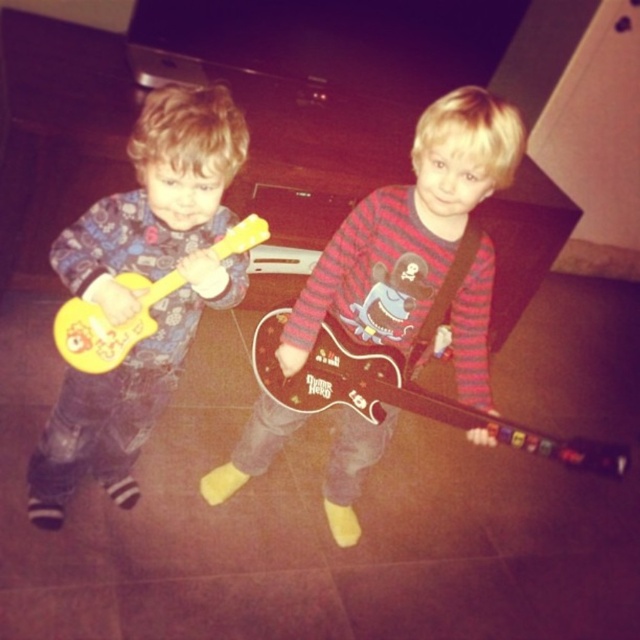
Question: Which point is farther to the camera?

Choices:
 (A) pyautogui.click(x=221, y=257)
 (B) pyautogui.click(x=420, y=218)
 (C) pyautogui.click(x=561, y=451)

Answer: (B)

Question: Can you confirm if matte brown guitar at center is thinner than matte yellow toy guitar at left?

Choices:
 (A) no
 (B) yes

Answer: (A)

Question: Which of the following is the farthest from the observer?

Choices:
 (A) matte brown guitar at center
 (B) yellow matte guitar at left
 (C) glossy plastic guitar at center
 (D) matte yellow toy guitar at left

Answer: (C)

Question: Where is matte brown guitar at center located in relation to matte yellow toy guitar at left in the image?

Choices:
 (A) above
 (B) below

Answer: (B)

Question: Does glossy plastic guitar at center have a greater width compared to yellow matte guitar at left?

Choices:
 (A) yes
 (B) no

Answer: (A)

Question: Which point is farther to the camera?

Choices:
 (A) coord(243,266)
 (B) coord(401,392)
 (C) coord(64,307)
 (D) coord(390,257)

Answer: (D)